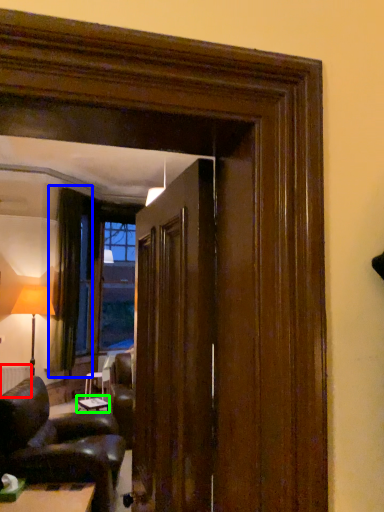
Question: Which is nearer to the radiator (highlighted by a red box)? curtain (highlighted by a blue box) or table (highlighted by a green box).

Choices:
 (A) curtain
 (B) table

Answer: (B)